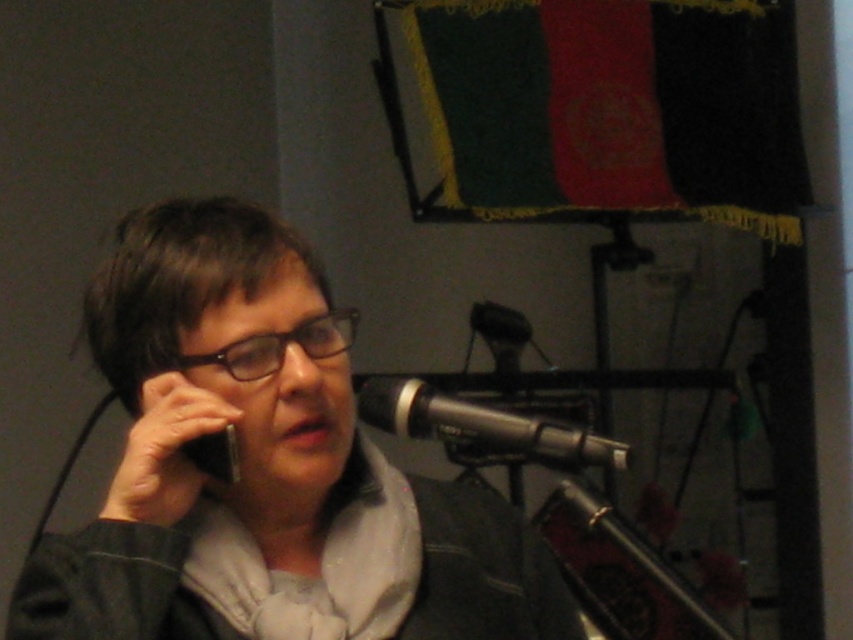
You are organizing a live event and need to ensure that the black metallic microphone at center and the black matte smartphone at upper left are visible to the audience. Based on their heights, which one is more likely to block the view of the other?

The black metallic microphone at center is much taller than the black matte smartphone at upper left, so it is more likely to block the view of the smartphone.

You are a sound technician setting up for a live event. You have a matte black phone at center and a black metallic microphone at center on stage. The performer wants to ensure they can hold the phone and use the microphone simultaneously without moving too far. Given that the average human arm span is about 36 inches, can they reach both items at the same time?

The matte black phone at center and black metallic microphone at center are 37.90 inches apart from each other. Since the average human arm span is 36 inches, the performer would not be able to reach both items simultaneously without moving closer or adjusting their position.

You are organizing an event and need to place a 12cm wide decorative item between the matte black phone at center and the black metallic microphone at center. Given their sizes, can you fit it there?

The matte black phone at center is larger in size than the black metallic microphone at center. Therefore, the space between them might be sufficient to place a 12cm wide decorative item, but it ultimately depends on the exact dimensions of the available space between the two objects.